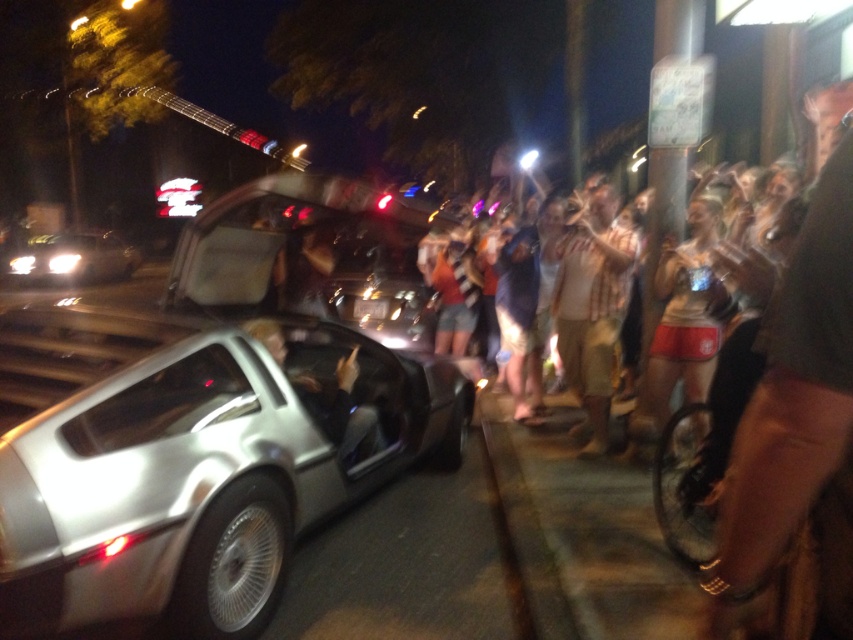
Does white cotton shirt at center appear on the right side of shiny chrome car at left?

Indeed, white cotton shirt at center is positioned on the right side of shiny chrome car at left.

Can you confirm if white cotton shirt at center is thinner than shiny chrome car at left?

Correct, white cotton shirt at center's width is less than shiny chrome car at left's.

The image size is (853, 640). In order to click on white cotton shirt at center in this screenshot , I will do pos(592,308).

Can you confirm if white cotton shirt at center is positioned to the right of metallic silver car door at center?

Yes, white cotton shirt at center is to the right of metallic silver car door at center.

Who is more forward, (614, 305) or (320, 401)?

Point (320, 401) is in front.

At what (x,y) coordinates should I click in order to perform the action: click on white cotton shirt at center. Please return your answer as a coordinate pair (x, y). The image size is (853, 640). Looking at the image, I should click on (592, 308).

The height and width of the screenshot is (640, 853). Describe the element at coordinates (193, 460) in the screenshot. I see `silver metallic delorean at center` at that location.

Which is behind, point (219, 460) or point (634, 252)?

Positioned behind is point (634, 252).

Identify the location of silver metallic delorean at center. (193, 460).